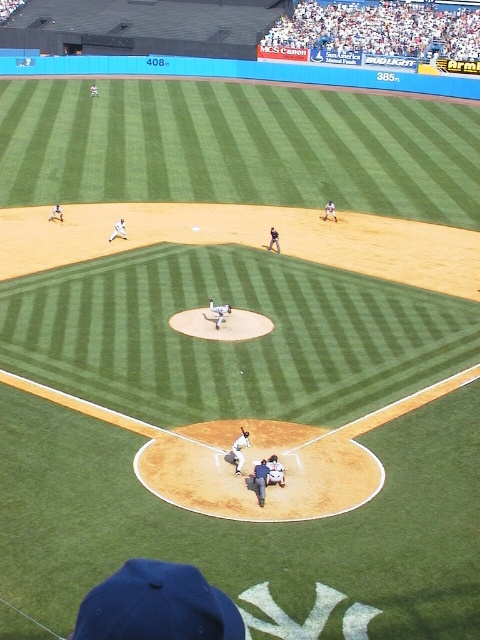
Question: Is blue fabric referee at center to the left of dark brown leather glove at home plate from the viewer's perspective?

Choices:
 (A) yes
 (B) no

Answer: (B)

Question: Which object is positioned farthest from the wooden bat at home plate?

Choices:
 (A) white matte baseball player at upper left
 (B) white fabric catcher at center

Answer: (A)

Question: Among these objects, which one is nearest to the camera?

Choices:
 (A) blue fabric referee at center
 (B) wooden bat at home plate
 (C) white jersey baseball team at upper center
 (D) white matte baseball player at upper left

Answer: (A)

Question: In this image, where is blue fabric referee at center located relative to white fabric catcher at center?

Choices:
 (A) right
 (B) left

Answer: (B)

Question: Is white jersey baseball team at upper center to the right of blue fabric referee at center from the viewer's perspective?

Choices:
 (A) no
 (B) yes

Answer: (B)

Question: Among these points, which one is farthest from the camera?

Choices:
 (A) (266, 465)
 (B) (240, 445)
 (C) (240, 428)
 (D) (120, 234)

Answer: (D)